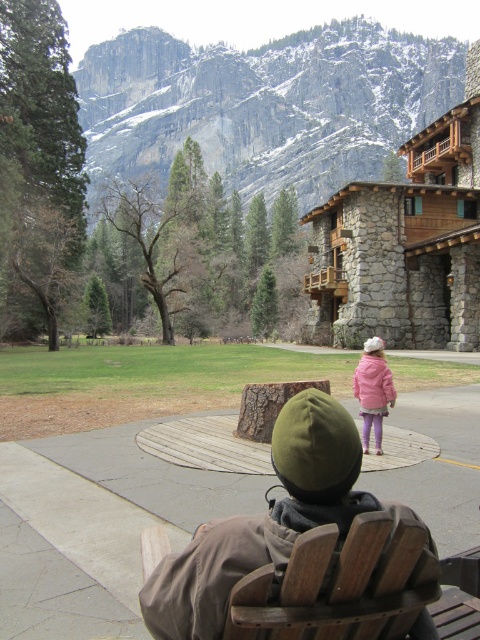
Question: Which point is farther to the camera?

Choices:
 (A) wooden chair at center
 (B) dark green knit hat at center

Answer: (B)

Question: Which point appears closest to the camera in this image?

Choices:
 (A) (260, 592)
 (B) (385, 378)

Answer: (A)

Question: Which of the following is the closest to the observer?

Choices:
 (A) wooden chair at center
 (B) dark green knit hat at center
 (C) matte pink coat at center
 (D) gray rocky mountain at upper center

Answer: (A)

Question: Does gray rocky mountain at upper center have a larger size compared to wooden chair at center?

Choices:
 (A) yes
 (B) no

Answer: (A)

Question: Observing the image, what is the correct spatial positioning of gray rocky mountain at upper center in reference to wooden chair at center?

Choices:
 (A) below
 (B) above

Answer: (B)

Question: Is dark green knit hat at center to the right of wooden chair at center from the viewer's perspective?

Choices:
 (A) yes
 (B) no

Answer: (B)